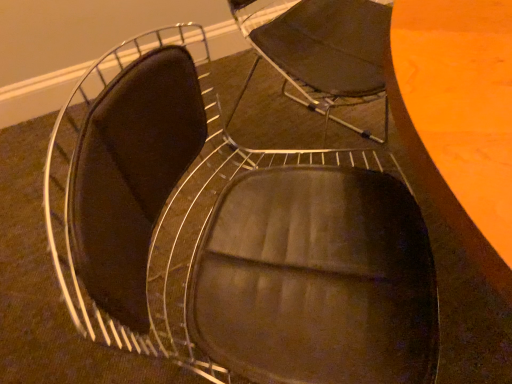
Consider the image. What is the approximate width of metallic wire chair at center?

The width of metallic wire chair at center is 51.28 centimeters.

This screenshot has width=512, height=384. I want to click on metallic wire chair at center, so (232, 237).

Describe the element at coordinates (232, 237) in the screenshot. The width and height of the screenshot is (512, 384). I see `metallic wire chair at center` at that location.

Find the location of a particular element. metallic wire chair at center is located at coordinates coord(232,237).